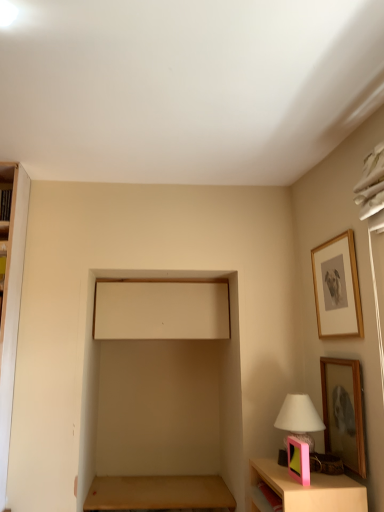
Identify the location of blank space above brown wooden table at lower center (from a real-world perspective). (172, 487).